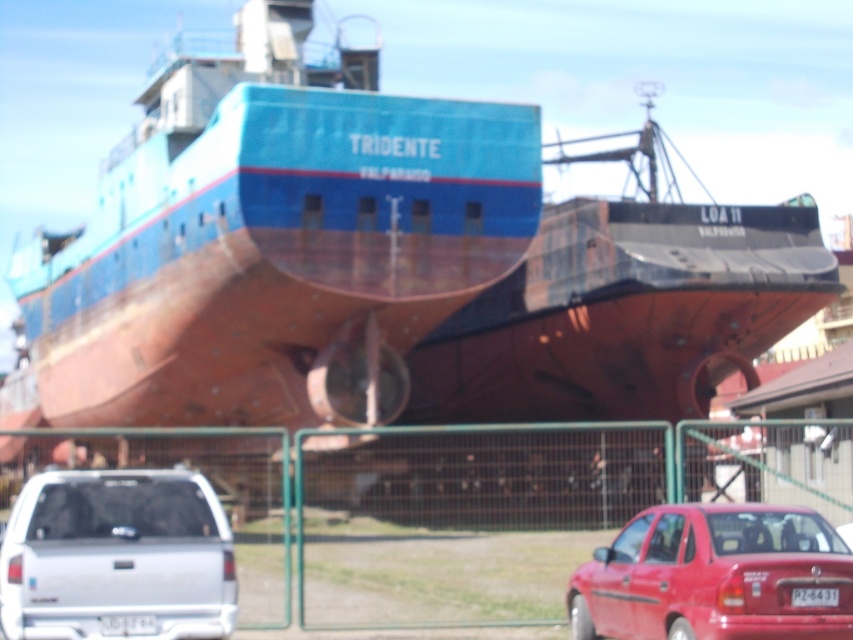
You are standing at the center of the fenced area in front of the ship. You need to locate the silver metallic pickup truck at lower left. Based on the coordinates provided, in which direction should you look to find it?

The silver metallic pickup truck at lower left is located at coordinates point (x=115, y=556). Since the y coordinate is 0.137, which is lower than the center point of 0.5, you should look downward to find it.

You are a photographer standing in front of the fenced area. You want to take a photo of the ship TRIDENTE. To ensure both the shiny red sedan at lower right and the white plastic license plate at center are clearly visible in the frame, which object should be closer to the camera to avoid cropping?

The shiny red sedan at lower right is wider than the white plastic license plate at center. To avoid cropping, position the shiny red sedan at lower right closer to the camera since its greater width requires more space in the frame.

You are standing at the fence and want to reach the point marked at coordinates point (154,618). If your walking speed is 1.2 meters per second, how many seconds will it take you to reach that point?

The distance of point (154,618) from camera is 17.49 meters. At a speed of 1.2 meters per second, it would take approximately 14.58 seconds to reach the point.